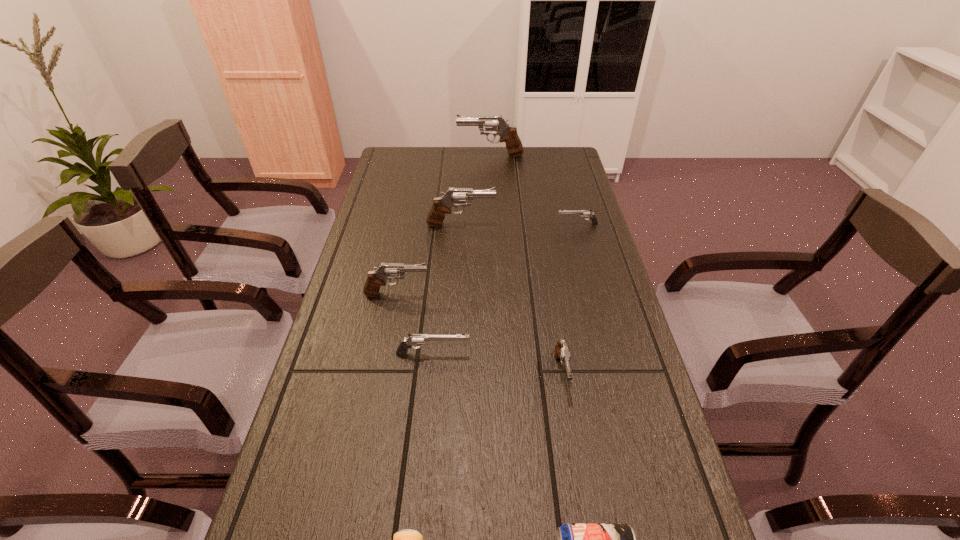
Identify the location of the tallest object. (508, 134).

I want to click on the farthest gray pistol, so click(508, 134).

The height and width of the screenshot is (540, 960). In order to click on the third nearest gray pistol in this screenshot , I will do `click(454, 197)`.

Find the location of a particular element. This screenshot has width=960, height=540. the fifth shortest pistol is located at coordinates (454, 197).

The width and height of the screenshot is (960, 540). What are the coordinates of `the fifth nearest object` in the screenshot? It's located at (376, 278).

Identify the location of the second smallest gray pistol. (376, 278).

The width and height of the screenshot is (960, 540). In order to click on the rightmost gray pistol in this screenshot , I will do `click(562, 352)`.

I want to click on the second pistol from right to left, so click(x=562, y=352).

Find the location of a particular element. Image resolution: width=960 pixels, height=540 pixels. the bigger silver pistol is located at coordinates (413, 339).

The image size is (960, 540). I want to click on the left silver pistol, so click(413, 339).